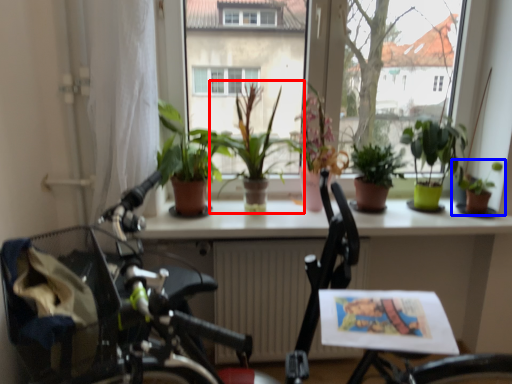
Question: Which of the following is the closest to the observer, houseplant (highlighted by a red box) or houseplant (highlighted by a blue box)?

Choices:
 (A) houseplant
 (B) houseplant

Answer: (A)